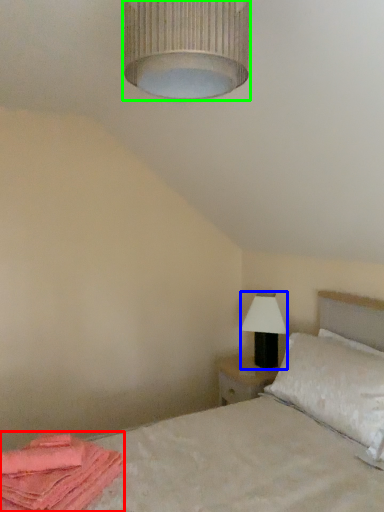
Question: Based on their relative distances, which object is farther from material (highlighted by a red box)? Choose from table lamp (highlighted by a blue box) and lamp (highlighted by a green box).

Choices:
 (A) table lamp
 (B) lamp

Answer: (A)